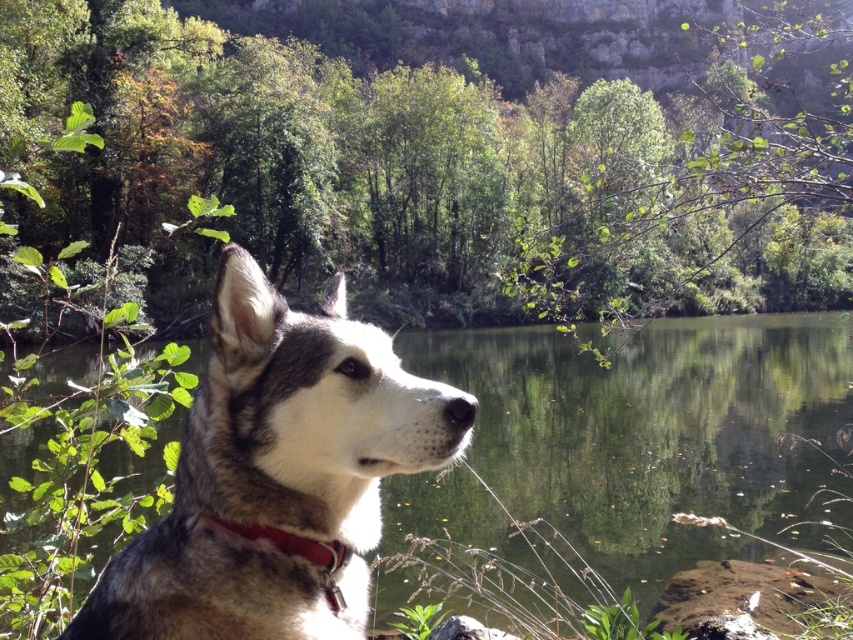
You are a photographer standing in front of the scene. You want to take a photo that includes both the green reflective water at center and the red leather collar at center. Which object will appear closer to the camera in the photo?

The red leather collar at center will appear closer to the camera in the photo because it is closer to the viewer than the green reflective water at center.

You are a photographer trying to capture the dog in the scene. The dog is on the left side of the frame, and you want to ensure the red leather collar at center and green reflective water at center are visible in the shot. Which object is closer to the camera?

The red leather collar at center is closer to the camera because the green reflective water at center is positioned over it, indicating it is in front.

You are standing in the scene and want to take a photo of the green reflective water at center. Where should you aim your camera to capture it?

You should aim your camera at point (653, 429) to capture the green reflective water at center.